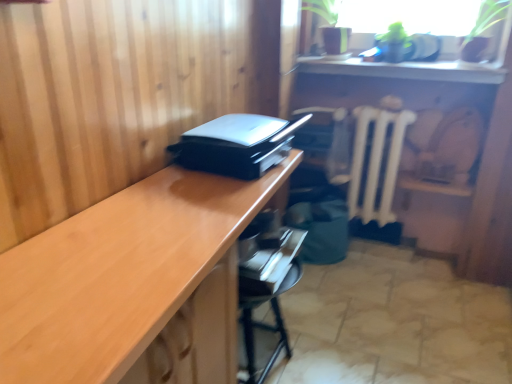
The image size is (512, 384). Identify the location of free point in front of black plastic printer at center. (187, 205).